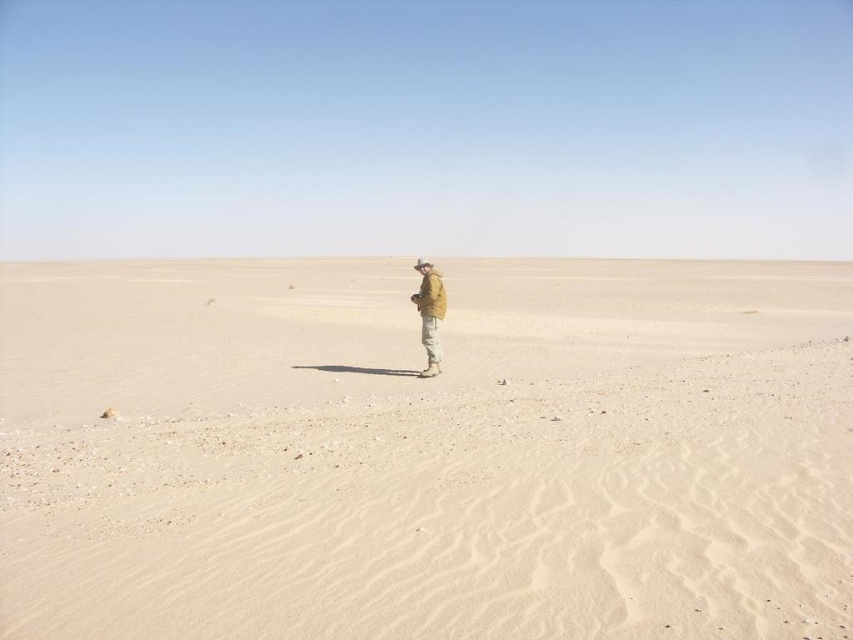
Question: Is light beige sand at center below tan fabric jacket at center?

Choices:
 (A) yes
 (B) no

Answer: (B)

Question: Can you confirm if light beige sand at center is wider than tan fabric jacket at center?

Choices:
 (A) yes
 (B) no

Answer: (A)

Question: Which of the following is the farthest from the observer?

Choices:
 (A) light beige sand at center
 (B) tan fabric jacket at center

Answer: (B)

Question: Does light beige sand at center appear over tan fabric jacket at center?

Choices:
 (A) no
 (B) yes

Answer: (B)